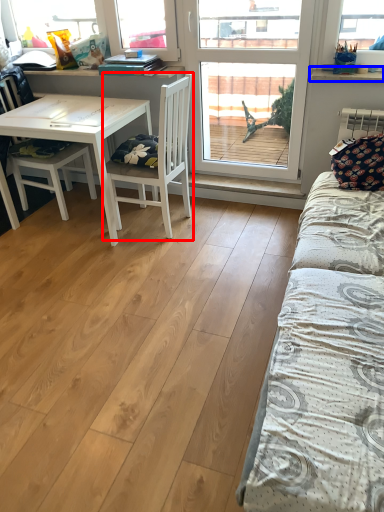
Question: Which point is closer to the camera, chair (highlighted by a red box) or window sill (highlighted by a blue box)?

Choices:
 (A) chair
 (B) window sill

Answer: (A)